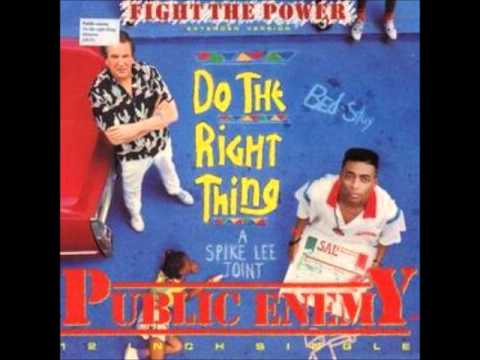
You are a GUI agent. You are given a task and a screenshot of the screen. Output one action in this format:
    pyautogui.click(x=<x>, y=<y>)
    Task: Click on the chalk markings on floor
    
    Given the screenshot: What is the action you would take?
    pyautogui.click(x=283, y=55), pyautogui.click(x=217, y=58), pyautogui.click(x=203, y=54), pyautogui.click(x=242, y=58)